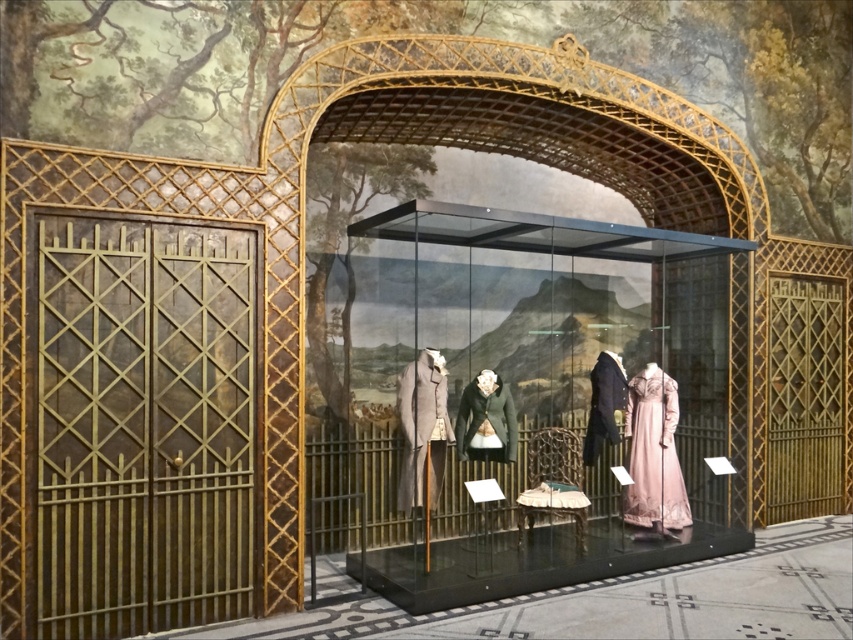
You are a visitor at the museum and want to take a photo of the pink satin dress at center without the gold textured gate at left blocking the view. Is this possible?

The gold textured gate at left is positioned over the pink satin dress at center, so it will block the view. You cannot take a photo of the pink satin dress at center without the gold textured gate at left blocking the view.

You are standing in front of the museum display box. There are two points marked on the display box. The first point is at coordinates point (637, 468) and the second is at point (416, 368). If you were to draw a line from your eye level to each point, which point would be further away from you?

Point (637, 468) is behind point (416, 368), so it would be further away from you.